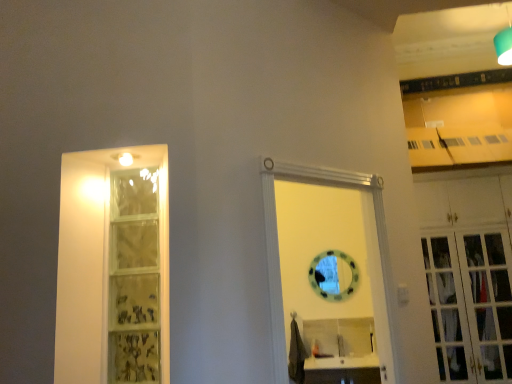
Locate an element on the screen. matte glass shelf at left is located at coordinates tap(134, 277).

The height and width of the screenshot is (384, 512). What are the coordinates of `white wood cabinet at right` in the screenshot? It's located at (469, 276).

Is white wooden door at center far away from matte glass shelf at left?

They are positioned close to each other.

Which of these two, white wooden door at center or matte glass shelf at left, stands taller?

Standing taller between the two is white wooden door at center.

Is matte glass shelf at left at the back of white wooden door at center?

That's not correct — white wooden door at center is not looking away from matte glass shelf at left.

From the picture: What's the angular difference between white wooden door at center and matte glass shelf at left's facing directions?

white wooden door at center and matte glass shelf at left are facing 47.4 degrees away from each other.

Is matte glass shelf at left behind white wooden door at center?

That is True.

Is point (142, 353) in front of point (357, 184)?

No, it is behind (357, 184).

From the image's perspective, is matte glass shelf at left beneath white wooden door at center?

No, from the image's perspective, matte glass shelf at left is not below white wooden door at center.

How different are the orientations of matte glass shelf at left and white wooden door at center in degrees?

The facing directions of matte glass shelf at left and white wooden door at center are 47.4 degrees apart.

From the picture: Which is in front, matte glass shelf at left or white wood cabinet at right?

Positioned in front is matte glass shelf at left.

Considering the positions of objects matte glass shelf at left and white wood cabinet at right in the image provided, who is more to the right, matte glass shelf at left or white wood cabinet at right?

Positioned to the right is white wood cabinet at right.

Locate an element on the screen. This screenshot has width=512, height=384. cabinetry on the right of matte glass shelf at left is located at coordinates coord(469,276).

Do you think matte glass shelf at left is within white wood cabinet at right, or outside of it?

→ matte glass shelf at left exists outside the volume of white wood cabinet at right.

Is white wooden door at center beside white wood cabinet at right?

No, white wooden door at center is not touching white wood cabinet at right.

From the image's perspective, which is above, white wooden door at center or white wood cabinet at right?

white wooden door at center, from the image's perspective.

Does white wooden door at center have a lesser width compared to white wood cabinet at right?

Yes.

Is white wood cabinet at right to the left or to the right of matte glass shelf at left in the image?

white wood cabinet at right is to the right of matte glass shelf at left.

Considering the sizes of white wood cabinet at right and matte glass shelf at left in the image, is white wood cabinet at right taller or shorter than matte glass shelf at left?

Considering their sizes, white wood cabinet at right has more height than matte glass shelf at left.

Is white wood cabinet at right oriented towards matte glass shelf at left?

No, white wood cabinet at right is not turned towards matte glass shelf at left.

Is white wood cabinet at right in front of matte glass shelf at left?

No, white wood cabinet at right is further to the viewer.

Is white wood cabinet at right not close to white wooden door at center?

Yes, white wood cabinet at right and white wooden door at center are located far from each other.

Considering the relative positions of white wood cabinet at right and white wooden door at center in the image provided, is white wood cabinet at right to the left or to the right of white wooden door at center?

From the image, it's evident that white wood cabinet at right is to the right of white wooden door at center.

Is white wood cabinet at right spatially inside white wooden door at center, or outside of it?

white wood cabinet at right is spatially situated outside white wooden door at center.

How many degrees apart are the facing directions of white wood cabinet at right and white wooden door at center?

44.8 degrees.

The height and width of the screenshot is (384, 512). What are the coordinates of `door below the matte glass shelf at left (from the image's perspective)` in the screenshot? It's located at (277, 237).

Image resolution: width=512 pixels, height=384 pixels. What are the coordinates of `door below the matte glass shelf at left (from a real-world perspective)` in the screenshot? It's located at (277, 237).

When comparing their distances from matte glass shelf at left, does white wooden door at center or white wood cabinet at right seem closer?

Among the two, white wooden door at center is located nearer to matte glass shelf at left.

When comparing their distances from white wood cabinet at right, does white wooden door at center or matte glass shelf at left seem closer?

white wooden door at center.

Which object lies nearer to the anchor point white wooden door at center, matte glass shelf at left or white wood cabinet at right?

matte glass shelf at left.

When comparing their distances from white wood cabinet at right, does matte glass shelf at left or white wooden door at center seem closer?

Among the two, white wooden door at center is located nearer to white wood cabinet at right.

From the image, which object appears to be nearer to matte glass shelf at left, white wood cabinet at right or white wooden door at center?

Among the two, white wooden door at center is located nearer to matte glass shelf at left.

Based on their spatial positions, is white wood cabinet at right or matte glass shelf at left further from white wooden door at center?

white wood cabinet at right.

Find the location of a particular element. This screenshot has height=384, width=512. door between matte glass shelf at left and white wood cabinet at right is located at coordinates (277, 237).